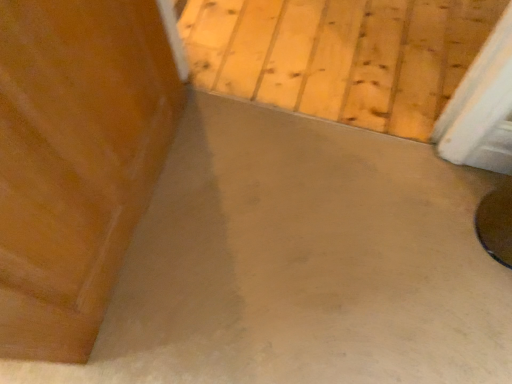
Find the location of a particular element. vacant space behind shiny brown table at lower right is located at coordinates (456, 174).